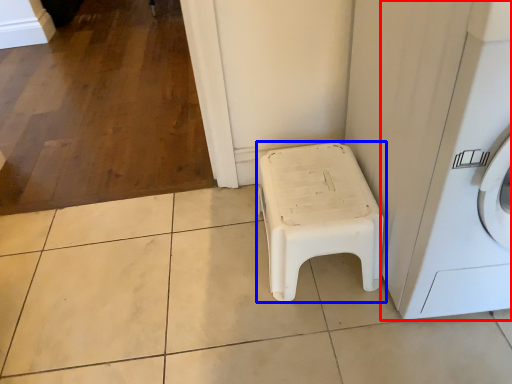
Question: Among these objects, which one is farthest to the camera, washing machine (highlighted by a red box) or furniture (highlighted by a blue box)?

Choices:
 (A) washing machine
 (B) furniture

Answer: (B)